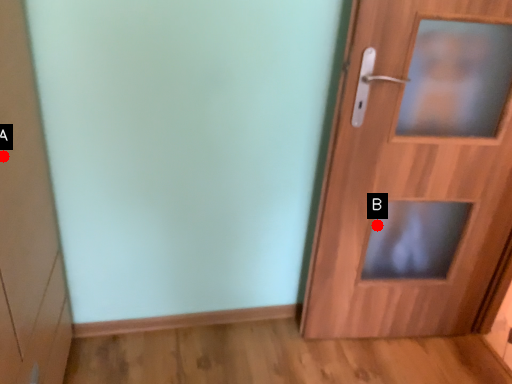
Question: Two points are circled on the image, labeled by A and B beside each circle. Which point appears closest to the camera in this image?

Choices:
 (A) A is closer
 (B) B is closer

Answer: (A)